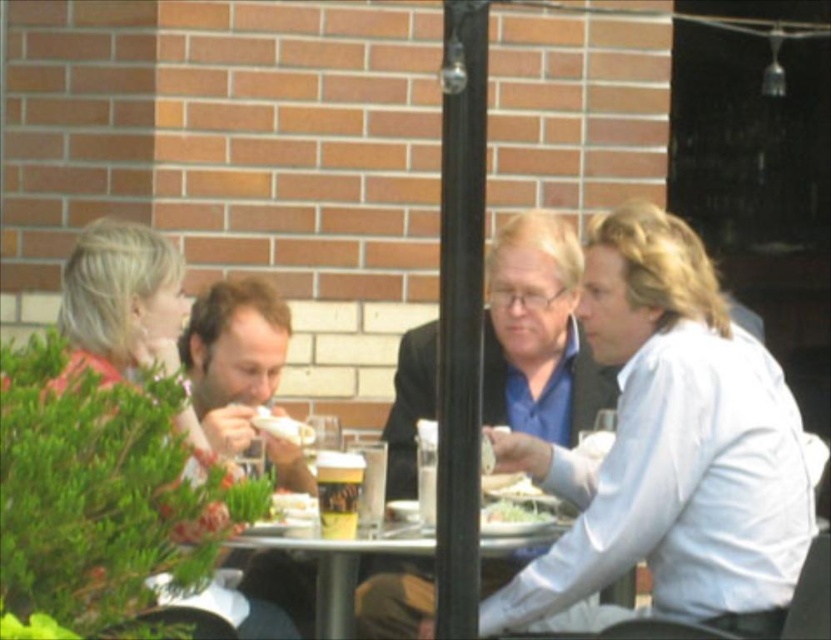
Is blue matte shirt at center taller than white paper plate at center?

Yes, blue matte shirt at center is taller than white paper plate at center.

Which is in front, point (588, 404) or point (505, 512)?

Point (505, 512) is in front.

The width and height of the screenshot is (831, 640). Find the location of `blue matte shirt at center`. blue matte shirt at center is located at coordinates (538, 333).

Does brown hair at center have a smaller size compared to translucent plastic cup at center?

No, brown hair at center is not smaller than translucent plastic cup at center.

Between brown hair at center and translucent plastic cup at center, which one appears on the right side from the viewer's perspective?

From the viewer's perspective, translucent plastic cup at center appears more on the right side.

Does point (266, 298) come farther from viewer compared to point (353, 460)?

That is True.

Image resolution: width=831 pixels, height=640 pixels. Identify the location of brown hair at center. (234, 356).

Does point (239, 452) lie behind point (430, 524)?

Yes, point (239, 452) is farther from viewer.

Who is higher up, brown hair at center or clear plastic cup at center?

brown hair at center is higher up.

Where is `brown hair at center`? This screenshot has width=831, height=640. brown hair at center is located at coordinates (234, 356).